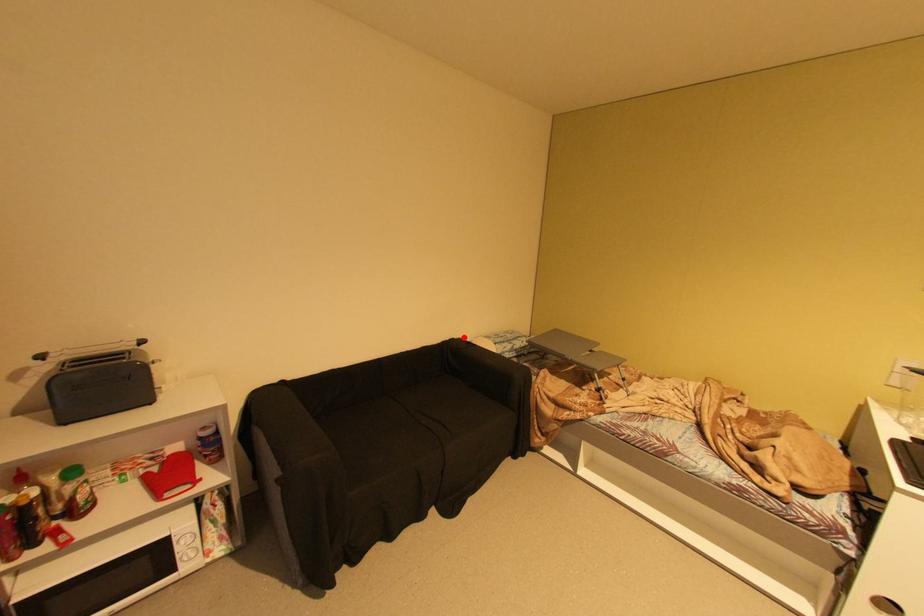
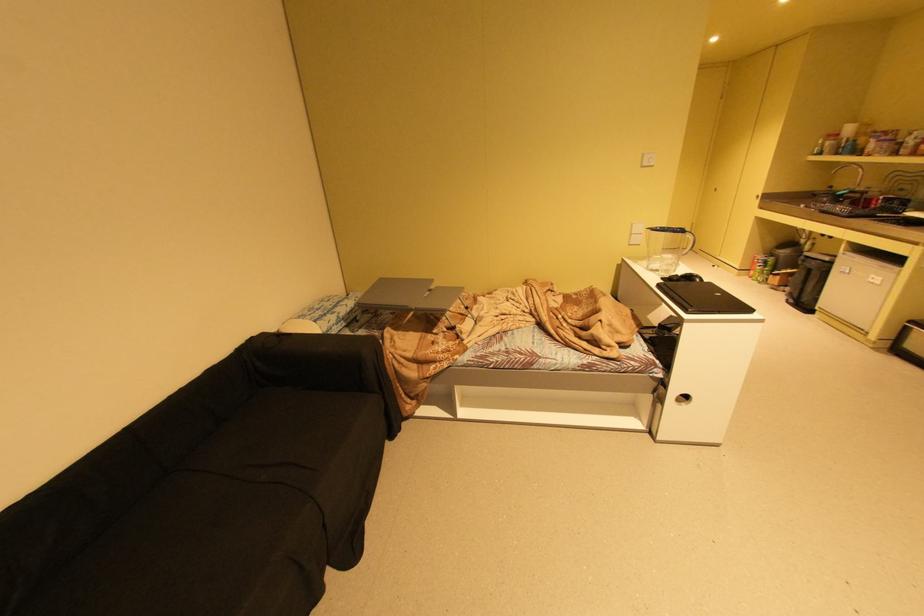
Find the pixel in the second image that matches the highlighted location in the first image.

(262, 334)